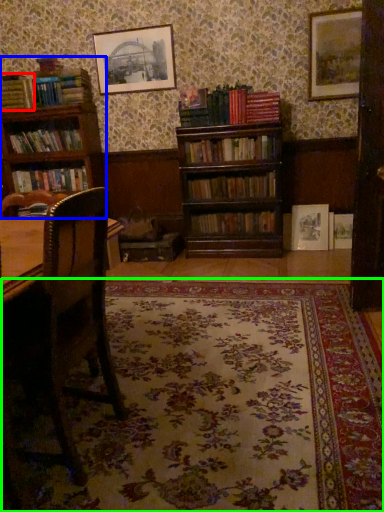
Question: Which is nearer to the book (highlighted by a red box)? bookcase (highlighted by a blue box) or pattern (highlighted by a green box).

Choices:
 (A) bookcase
 (B) pattern

Answer: (A)